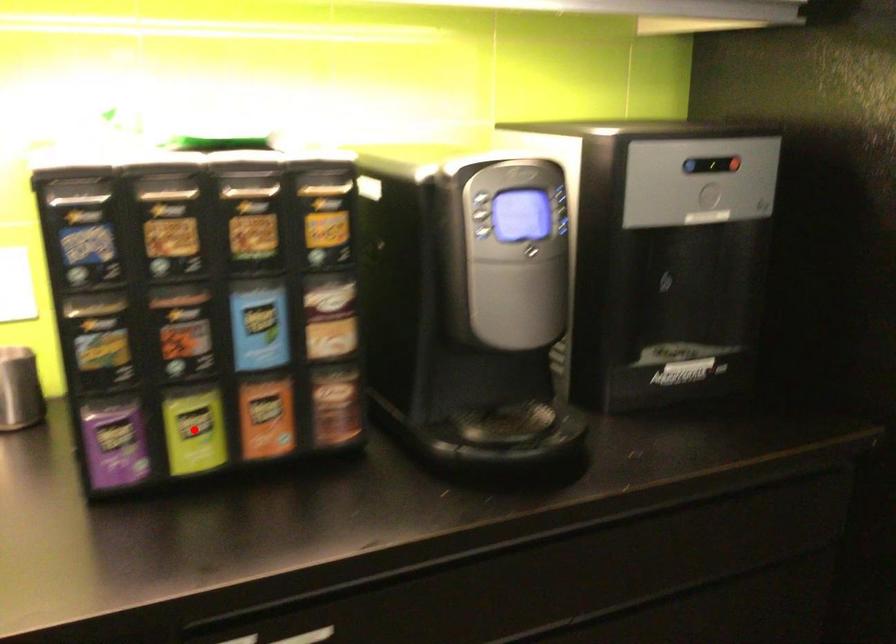
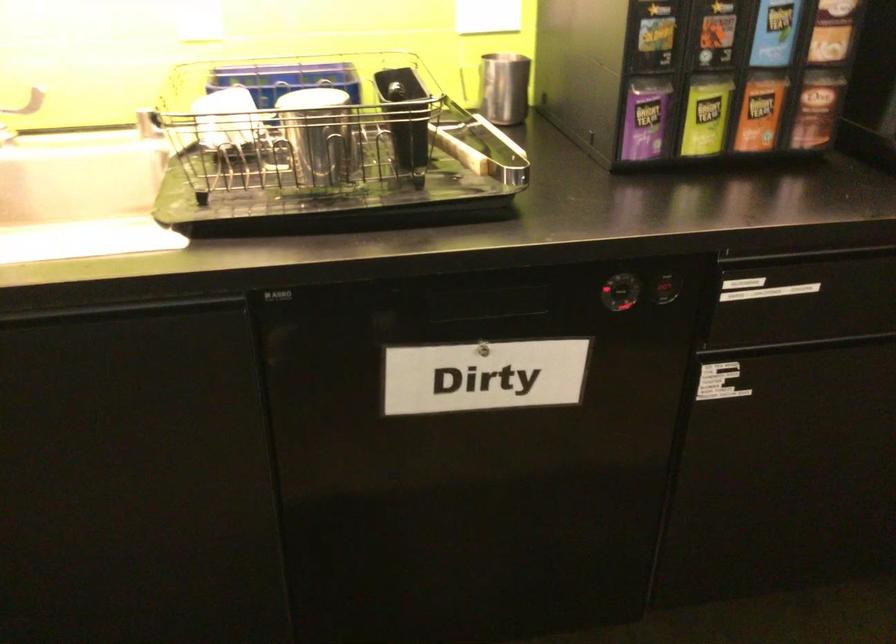
Locate, in the second image, the point that corresponds to the highlighted location in the first image.

(705, 116)